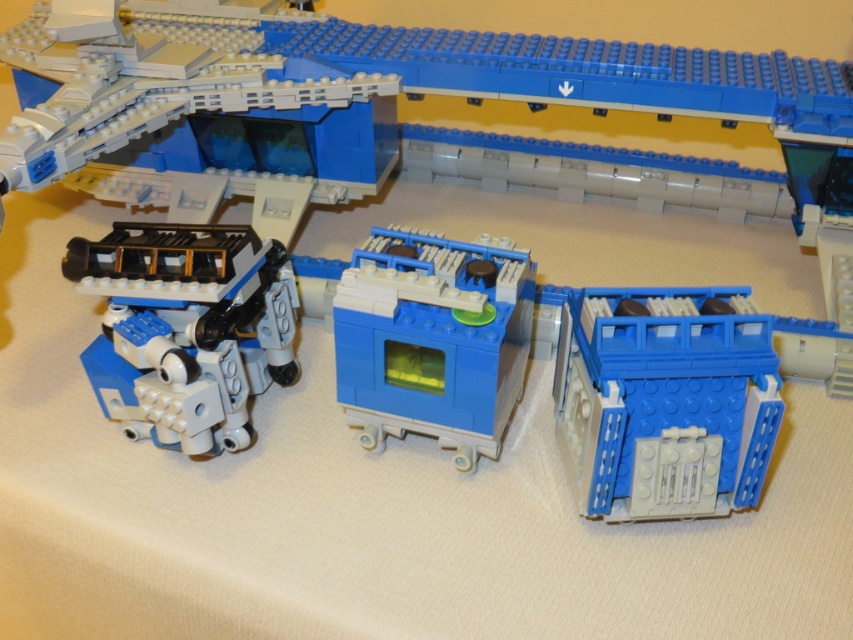
Question: From the image, what is the correct spatial relationship of matte black robot at lower left in relation to blue plastic machine at center?

Choices:
 (A) right
 (B) left

Answer: (B)

Question: Does blue plastic building at lower right lie behind matte black robot at lower left?

Choices:
 (A) no
 (B) yes

Answer: (A)

Question: Which object is the farthest from the blue plastic machine at center?

Choices:
 (A) matte black robot at lower left
 (B) blue plastic building at lower right

Answer: (A)

Question: Which object appears closest to the camera in this image?

Choices:
 (A) blue plastic machine at center
 (B) matte black robot at lower left
 (C) blue plastic building at lower right

Answer: (C)

Question: Which object is the closest to the matte black robot at lower left?

Choices:
 (A) blue plastic building at lower right
 (B) blue plastic machine at center

Answer: (B)

Question: Does blue plastic building at lower right lie in front of matte black robot at lower left?

Choices:
 (A) yes
 (B) no

Answer: (A)